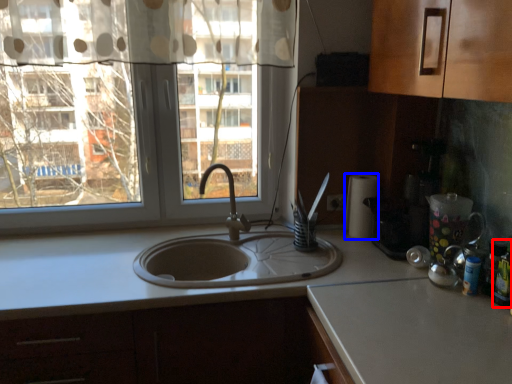
Question: Which of the following is the farthest to the observer, bottle (highlighted by a red box) or paper towel (highlighted by a blue box)?

Choices:
 (A) bottle
 (B) paper towel

Answer: (B)